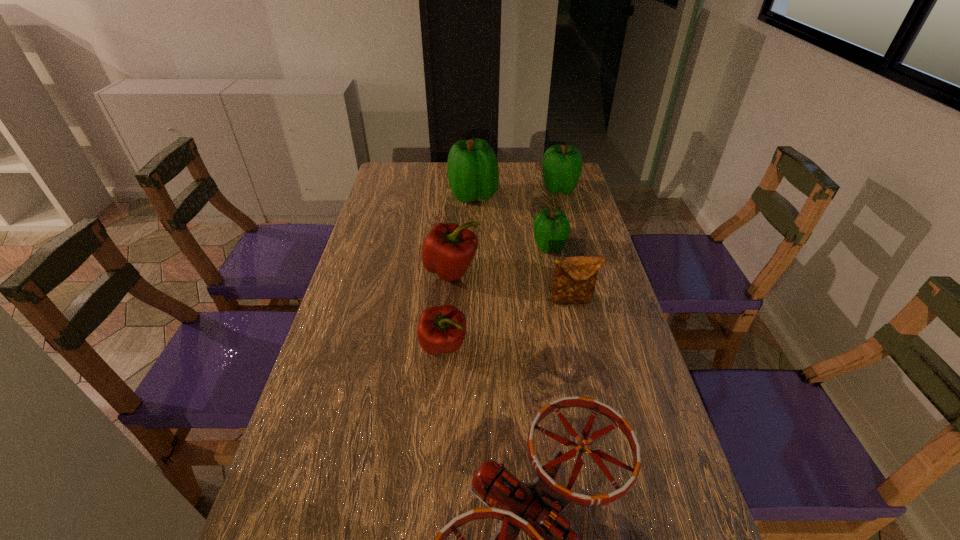
The height and width of the screenshot is (540, 960). I want to click on the tallest object, so click(x=472, y=167).

I want to click on the tallest bell pepper, so click(472, 167).

You are a GUI agent. You are given a task and a screenshot of the screen. Output one action in this format:
    pyautogui.click(x=<x>, y=<y>)
    Task: Click on the second smallest green bell pepper
    
    Given the screenshot: What is the action you would take?
    pyautogui.click(x=562, y=165)

You are a GUI agent. You are given a task and a screenshot of the screen. Output one action in this format:
    pyautogui.click(x=<x>, y=<y>)
    Task: Click on the bigger pink bell pepper
    This screenshot has height=540, width=960.
    Given the screenshot: What is the action you would take?
    pyautogui.click(x=448, y=249)

Where is `clutch bag`? clutch bag is located at coordinates (574, 279).

At what (x,y) coordinates should I click in order to perform the action: click on the smallest green bell pepper. Please return your answer as a coordinate pair (x, y). The image size is (960, 540). Looking at the image, I should click on (551, 228).

Where is `the nearer pink bell pepper`? the nearer pink bell pepper is located at coordinates (441, 329).

Find the location of a particular element. This screenshot has width=960, height=540. the sixth farthest object is located at coordinates (441, 329).

Identify the location of free space located on the front of the leftmost green bell pepper. This screenshot has height=540, width=960. (471, 245).

Locate an element on the screen. free space located on the front of the second biggest green bell pepper is located at coordinates (572, 237).